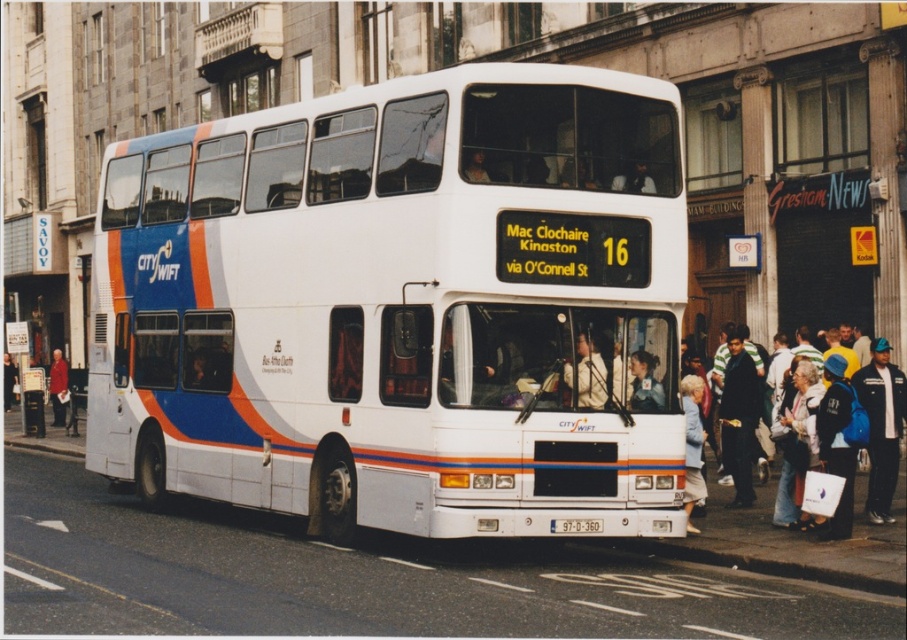
Question: Is blue fabric jacket at lower right in front of light beige fabric jacket at center?

Choices:
 (A) no
 (B) yes

Answer: (A)

Question: Is the position of denim jacket at lower right more distant than that of blue fabric jacket at lower right?

Choices:
 (A) no
 (B) yes

Answer: (A)

Question: Is dark blue jacket at lower right positioned before light blue shirt at center?

Choices:
 (A) yes
 (B) no

Answer: (B)

Question: Which object is the farthest from the white glossy decker bus at center?

Choices:
 (A) white fabric bag at lower right
 (B) denim jacket at lower right
 (C) light blue shirt at center

Answer: (B)

Question: Which is nearer to the denim jacket at lower right?

Choices:
 (A) dark blue jacket at lower right
 (B) white glossy decker bus at center
 (C) blue fabric jacket at lower right

Answer: (C)

Question: Which of the following is the closest to the observer?

Choices:
 (A) dark blue jacket at lower right
 (B) white glossy decker bus at center
 (C) denim jacket at lower right

Answer: (B)